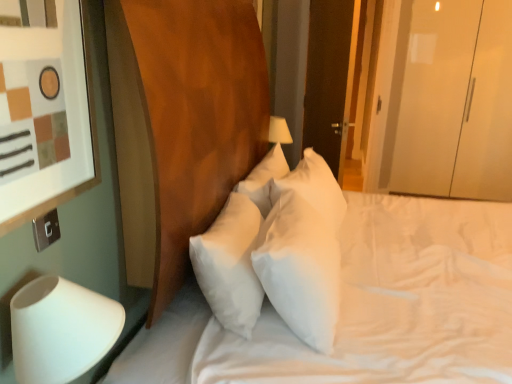
Question: Are dark wood door at upper right and silver metallic switch at lower left located far from each other?

Choices:
 (A) yes
 (B) no

Answer: (A)

Question: Can you confirm if dark wood door at upper right is positioned to the left of silver metallic switch at lower left?

Choices:
 (A) no
 (B) yes

Answer: (A)

Question: From a real-world perspective, is dark wood door at upper right beneath silver metallic switch at lower left?

Choices:
 (A) no
 (B) yes

Answer: (A)

Question: Is dark wood door at upper right wider than silver metallic switch at lower left?

Choices:
 (A) yes
 (B) no

Answer: (A)

Question: Is dark wood door at upper right smaller than silver metallic switch at lower left?

Choices:
 (A) yes
 (B) no

Answer: (B)

Question: From a real-world perspective, is dark wood door at upper right on silver metallic switch at lower left?

Choices:
 (A) yes
 (B) no

Answer: (A)

Question: Is white soft pillow at center behind dark wood door at upper right?

Choices:
 (A) no
 (B) yes

Answer: (A)

Question: Considering the relative positions of white soft pillow at center and dark wood door at upper right in the image provided, is white soft pillow at center to the right of dark wood door at upper right from the viewer's perspective?

Choices:
 (A) no
 (B) yes

Answer: (A)

Question: Is white soft pillow at center far away from dark wood door at upper right?

Choices:
 (A) yes
 (B) no

Answer: (A)

Question: From the image's perspective, is white soft pillow at center below dark wood door at upper right?

Choices:
 (A) no
 (B) yes

Answer: (B)

Question: Can you confirm if white soft pillow at center is shorter than dark wood door at upper right?

Choices:
 (A) no
 (B) yes

Answer: (B)

Question: Is the surface of white soft pillow at center in direct contact with dark wood door at upper right?

Choices:
 (A) yes
 (B) no

Answer: (B)

Question: Is white soft pillow at center facing towards silver metallic switch at lower left?

Choices:
 (A) no
 (B) yes

Answer: (A)